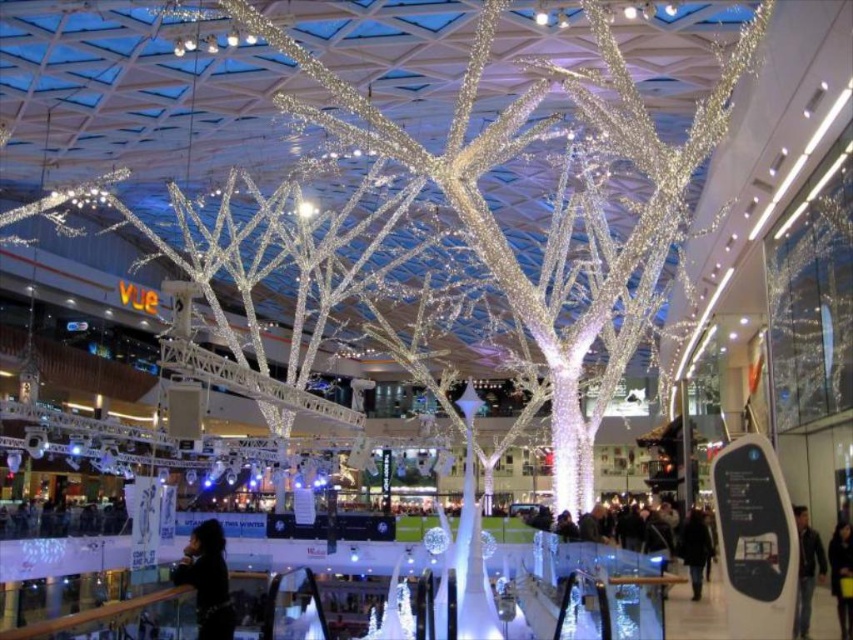
Identify the location of dark blue jacket at lower right. (805, 570).

Is dark blue jacket at lower right above black fabric at lower right?

Yes, dark blue jacket at lower right is above black fabric at lower right.

Does point (809, 605) lie behind point (849, 557)?

No, (809, 605) is in front of (849, 557).

Where is `dark blue jacket at lower right`? This screenshot has height=640, width=853. dark blue jacket at lower right is located at coordinates (805, 570).

Does dark hair at lower left appear over dark brown leather jacket at lower right?

Correct, dark hair at lower left is located above dark brown leather jacket at lower right.

Who is more forward, (216, 632) or (699, 531)?

Point (216, 632)

This screenshot has height=640, width=853. Find the location of `dark hair at lower left`. dark hair at lower left is located at coordinates (207, 580).

Does dark hair at lower left have a larger size compared to black fabric at lower right?

Correct, dark hair at lower left is larger in size than black fabric at lower right.

Does dark hair at lower left appear on the left side of black fabric at lower right?

Yes, dark hair at lower left is to the left of black fabric at lower right.

Is point (189, 561) in front of point (842, 538)?

Yes.

Where is `dark hair at lower left`? This screenshot has width=853, height=640. dark hair at lower left is located at coordinates (207, 580).